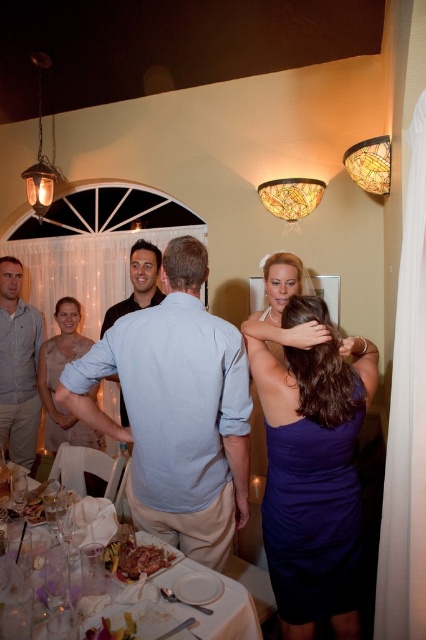
Which is above, striped cotton shirt at left or matte black shirt at center?

matte black shirt at center is higher up.

The height and width of the screenshot is (640, 426). I want to click on striped cotton shirt at left, so click(x=17, y=365).

Measure the distance between point (22, 404) and camera.

A distance of 3.42 meters exists between point (22, 404) and camera.

Image resolution: width=426 pixels, height=640 pixels. I want to click on striped cotton shirt at left, so click(x=17, y=365).

Can you confirm if shiny purple dress at center is positioned to the right of matte beige dress at center?

Correct, you'll find shiny purple dress at center to the right of matte beige dress at center.

Is shiny purple dress at center positioned in front of matte beige dress at center?

Yes, shiny purple dress at center is in front of matte beige dress at center.

Does point (353, 541) come in front of point (60, 307)?

Yes, point (353, 541) is in front of point (60, 307).

Locate an element on the screen. shiny purple dress at center is located at coordinates (230, 422).

Based on the photo, between purple satin dress at upper right and striped cotton shirt at left, which one is positioned higher?

Positioned higher is striped cotton shirt at left.

Which of these two, purple satin dress at upper right or striped cotton shirt at left, stands shorter?

Standing shorter between the two is purple satin dress at upper right.

The image size is (426, 640). I want to click on purple satin dress at upper right, so click(307, 362).